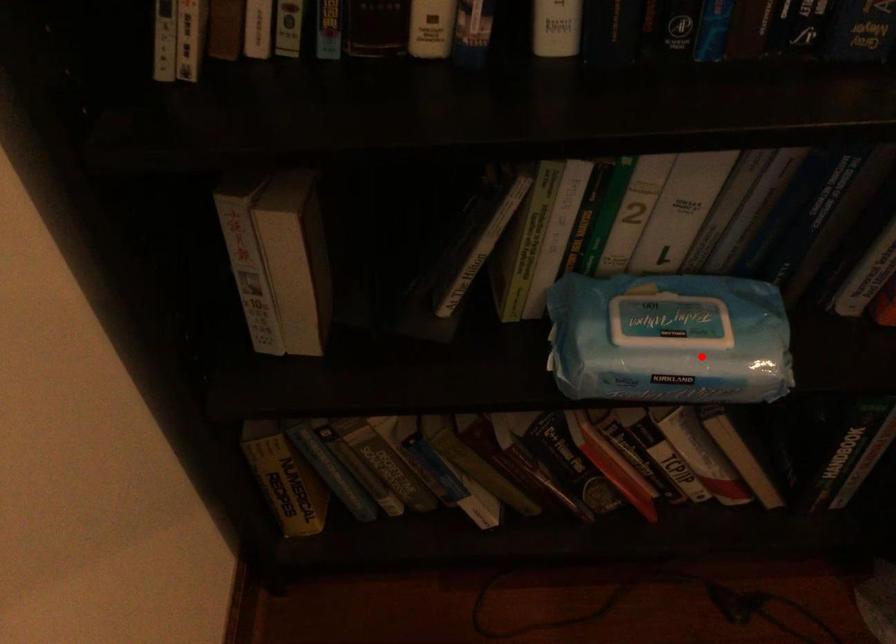
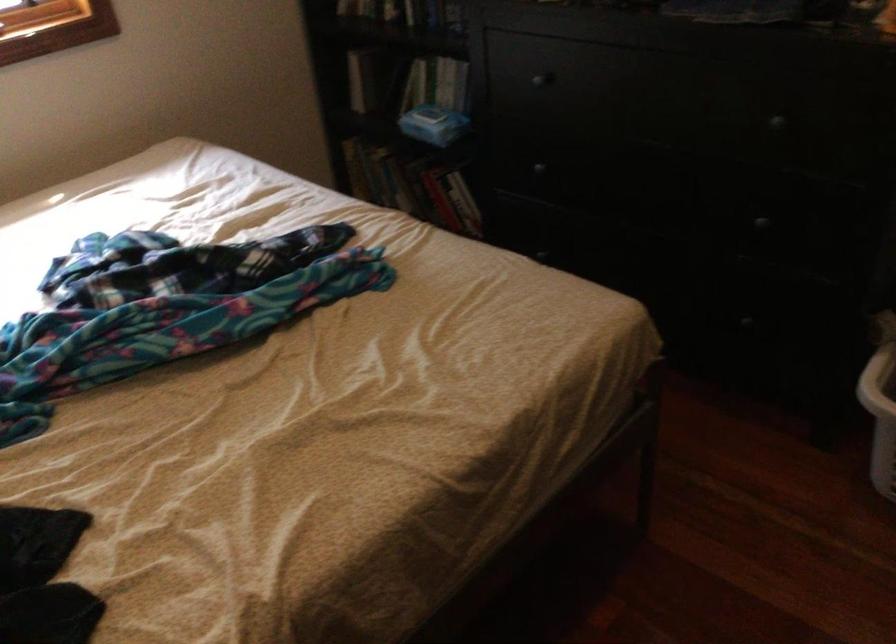
Find the pixel in the second image that matches the highlighted location in the first image.

(433, 124)